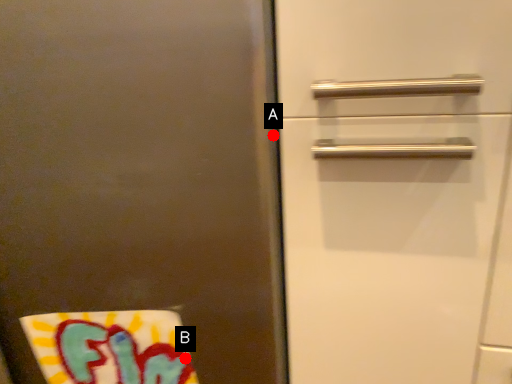
Question: Two points are circled on the image, labeled by A and B beside each circle. Which point is farther from the camera taking this photo?

Choices:
 (A) A is further
 (B) B is further

Answer: (B)